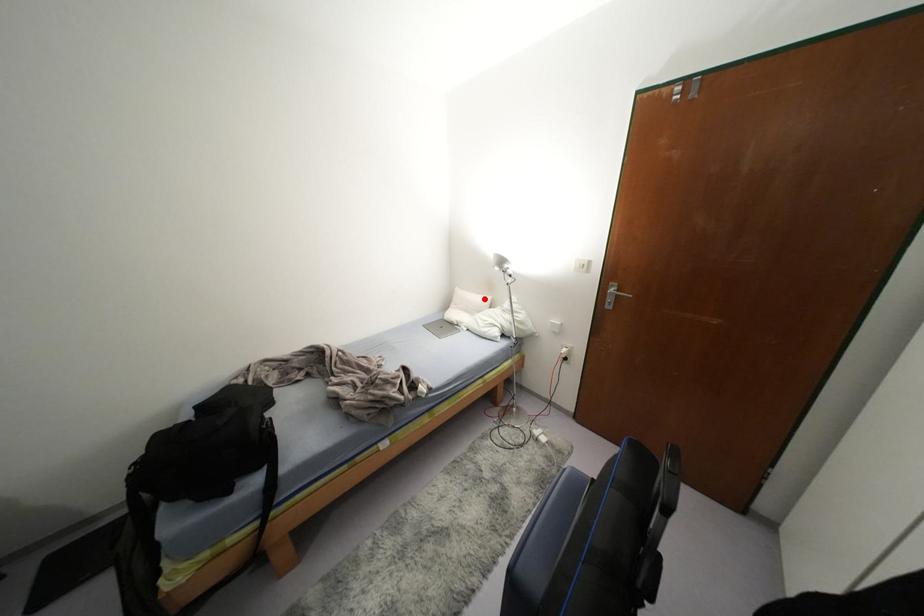
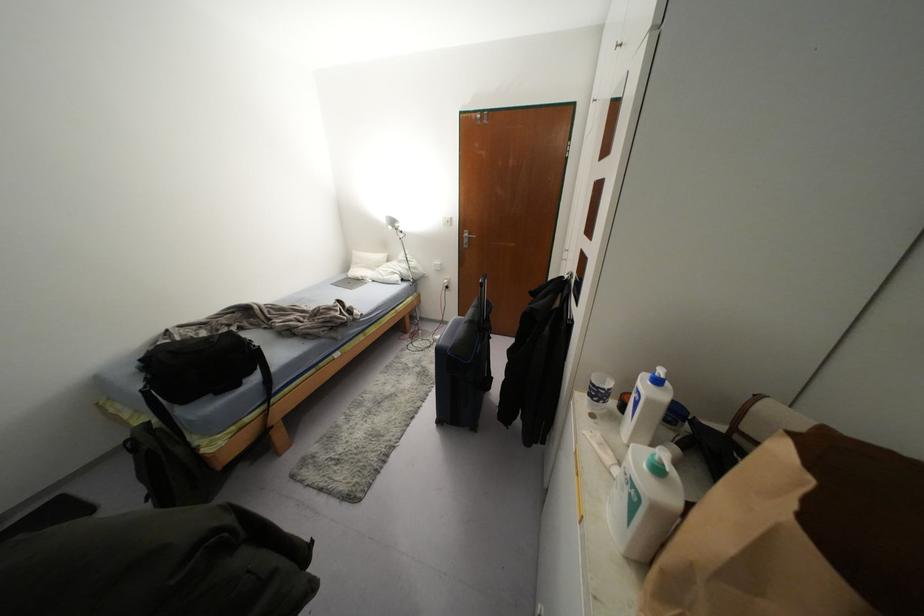
Locate, in the second image, the point that corresponds to the highlighted location in the first image.

(382, 256)